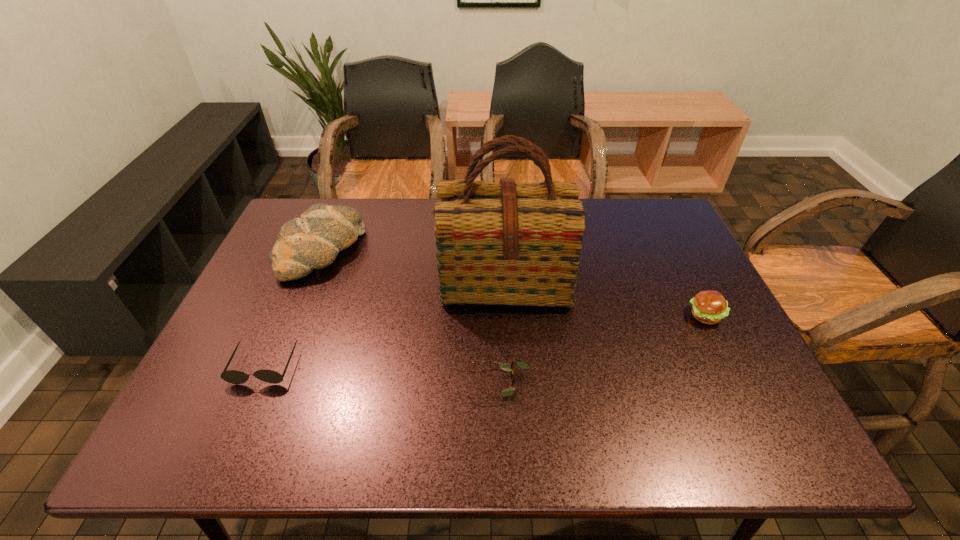
Find the location of a particular element. This screenshot has width=960, height=540. blank area located 0.370m on the front-facing side of the spectacles is located at coordinates (300, 383).

Identify the location of vacant space situated on the front-facing side of the spectacles. (368, 383).

I want to click on object that is at the far edge, so click(x=313, y=241).

Locate an element on the screen. The height and width of the screenshot is (540, 960). bread that is at the left edge is located at coordinates (x=313, y=241).

Where is `sunglasses situated at the left edge`? The image size is (960, 540). sunglasses situated at the left edge is located at coordinates (236, 377).

Locate an element on the screen. object present at the right edge is located at coordinates (709, 307).

Image resolution: width=960 pixels, height=540 pixels. Find the location of `object that is positioned at the far left corner`. object that is positioned at the far left corner is located at coordinates (313, 241).

This screenshot has height=540, width=960. Find the location of `blank area at the far edge`. blank area at the far edge is located at coordinates 426,225.

In the image, there is a desktop. Identify the location of vacant region at the near edge. (549, 418).

Locate an element on the screen. The height and width of the screenshot is (540, 960). vacant space at the left edge of the desktop is located at coordinates (257, 412).